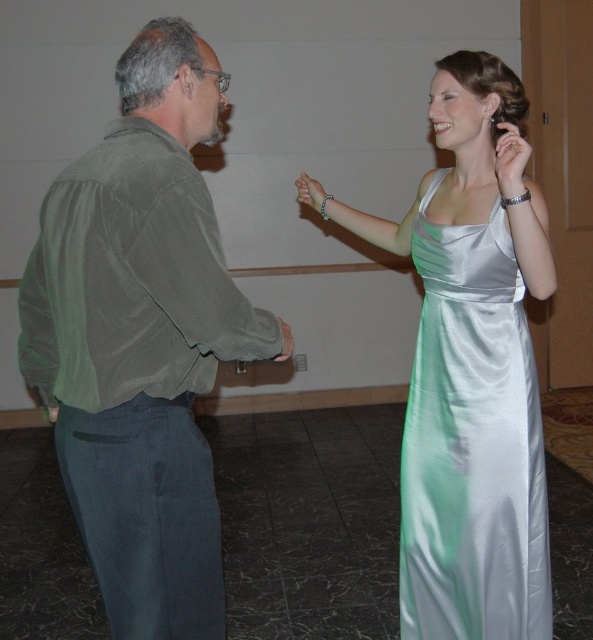
Consider the image. Is satin dress at right wider than silky silver dress at right?

Indeed, satin dress at right has a greater width compared to silky silver dress at right.

Is satin dress at right bigger than silky silver dress at right?

Indeed, satin dress at right has a larger size compared to silky silver dress at right.

You are a GUI agent. You are given a task and a screenshot of the screen. Output one action in this format:
    pyautogui.click(x=<x>, y=<y>)
    Task: Click on the satin dress at right
    The height and width of the screenshot is (640, 593).
    Given the screenshot: What is the action you would take?
    pyautogui.click(x=470, y=368)

You are a GUI agent. You are given a task and a screenshot of the screen. Output one action in this format:
    pyautogui.click(x=<x>, y=<y>)
    Task: Click on the satin dress at right
    The image size is (593, 640).
    Given the screenshot: What is the action you would take?
    pyautogui.click(x=470, y=368)

Is green satin shirt at left in front of satin dress at right?

Yes, it is.

Looking at this image, does green satin shirt at left have a smaller size compared to satin dress at right?

Yes.

Image resolution: width=593 pixels, height=640 pixels. Identify the location of green satin shirt at left. (141, 339).

Does point (278, 333) lie behind point (473, 570)?

No, it is in front of (473, 570).

Which is in front, point (196, 438) or point (537, 618)?

Point (196, 438) is in front.

Identify the location of green satin shirt at left. The image size is (593, 640). (141, 339).